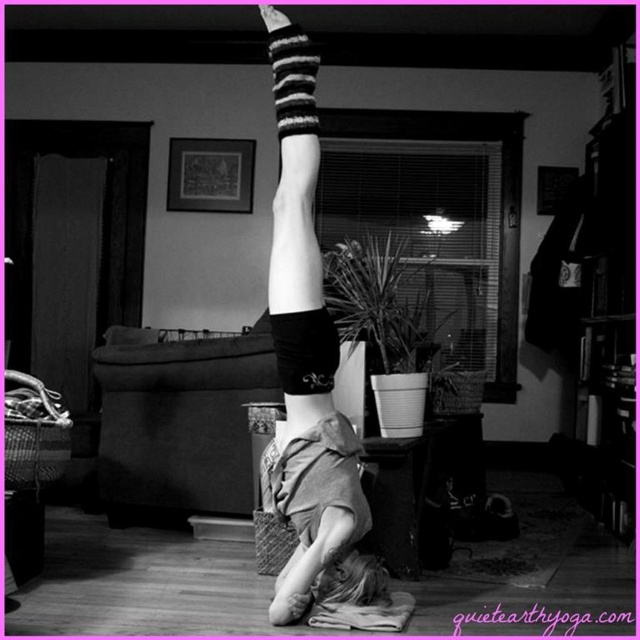
Question: Is smooth skin gymnast at center smaller than black striped sock at upper center?

Choices:
 (A) no
 (B) yes

Answer: (A)

Question: Which point appears closest to the camera in this image?

Choices:
 (A) (292, 412)
 (B) (312, 115)

Answer: (B)

Question: Can you confirm if smooth skin gymnast at center is thinner than black striped sock at upper center?

Choices:
 (A) yes
 (B) no

Answer: (B)

Question: Can you confirm if smooth skin gymnast at center is positioned to the left of black striped sock at upper center?

Choices:
 (A) no
 (B) yes

Answer: (A)

Question: Which point appears farthest from the camera in this image?

Choices:
 (A) (316, 58)
 (B) (348, 481)

Answer: (A)